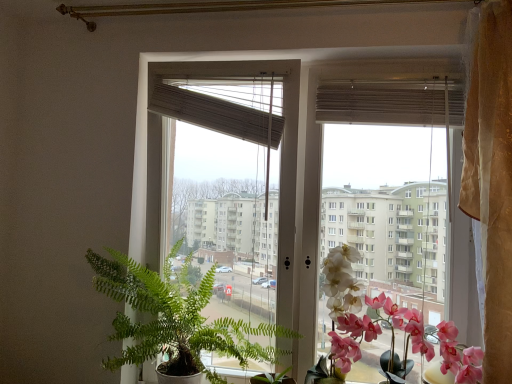
Question: Is beige woven blind at upper center, placed as the first blind when sorted from left to right, facing away from matte brown blind at upper center, placed as the second blind when sorted from left to right?

Choices:
 (A) no
 (B) yes

Answer: (A)

Question: From a real-world perspective, does beige woven blind at upper center, the 2th blind when ordered from right to left, sit lower than matte brown blind at upper center, which appears as the first blind when viewed from the right?

Choices:
 (A) no
 (B) yes

Answer: (B)

Question: From a real-world perspective, is beige woven blind at upper center, placed as the first blind when sorted from left to right, physically above matte brown blind at upper center, which appears as the first blind when viewed from the right?

Choices:
 (A) no
 (B) yes

Answer: (A)

Question: Can you confirm if beige woven blind at upper center, the 2th blind when ordered from right to left, is thinner than matte brown blind at upper center, placed as the second blind when sorted from left to right?

Choices:
 (A) no
 (B) yes

Answer: (B)

Question: Is the position of beige woven blind at upper center, placed as the first blind when sorted from left to right, more distant than that of matte brown blind at upper center, which appears as the first blind when viewed from the right?

Choices:
 (A) yes
 (B) no

Answer: (A)

Question: Is white matte orchid at right, which is the 1th flower in left-to-right order, wider or thinner than transparent glass window at center?

Choices:
 (A) thin
 (B) wide

Answer: (B)

Question: From the image's perspective, is white matte orchid at right, which is the 1th flower in left-to-right order, above or below transparent glass window at center?

Choices:
 (A) above
 (B) below

Answer: (B)

Question: Is white matte orchid at right, which is the 1th flower in left-to-right order, in front of or behind transparent glass window at center in the image?

Choices:
 (A) front
 (B) behind

Answer: (A)

Question: Would you say white matte orchid at right, placed as the 2th flower when sorted from right to left, is to the left or to the right of transparent glass window at center in the picture?

Choices:
 (A) right
 (B) left

Answer: (A)

Question: From their relative heights in the image, would you say beige woven blind at upper center, the 2th blind when ordered from right to left, is taller or shorter than pink silk orchid at right, the 1th flower viewed from the right?

Choices:
 (A) short
 (B) tall

Answer: (A)

Question: Is beige woven blind at upper center, placed as the first blind when sorted from left to right, inside or outside of pink silk orchid at right, positioned as the 2th flower in left-to-right order?

Choices:
 (A) outside
 (B) inside

Answer: (A)

Question: In the image, is beige woven blind at upper center, the 2th blind when ordered from right to left, positioned in front of or behind pink silk orchid at right, positioned as the 2th flower in left-to-right order?

Choices:
 (A) behind
 (B) front

Answer: (A)

Question: From the image's perspective, is beige woven blind at upper center, placed as the first blind when sorted from left to right, above or below pink silk orchid at right, positioned as the 2th flower in left-to-right order?

Choices:
 (A) below
 (B) above

Answer: (B)

Question: Looking at the image, does matte brown blind at upper center, placed as the second blind when sorted from left to right, seem bigger or smaller compared to white matte orchid at right, placed as the 2th flower when sorted from right to left?

Choices:
 (A) small
 (B) big

Answer: (A)

Question: From the image's perspective, relative to white matte orchid at right, which is the 1th flower in left-to-right order, is matte brown blind at upper center, which appears as the first blind when viewed from the right, above or below?

Choices:
 (A) above
 (B) below

Answer: (A)